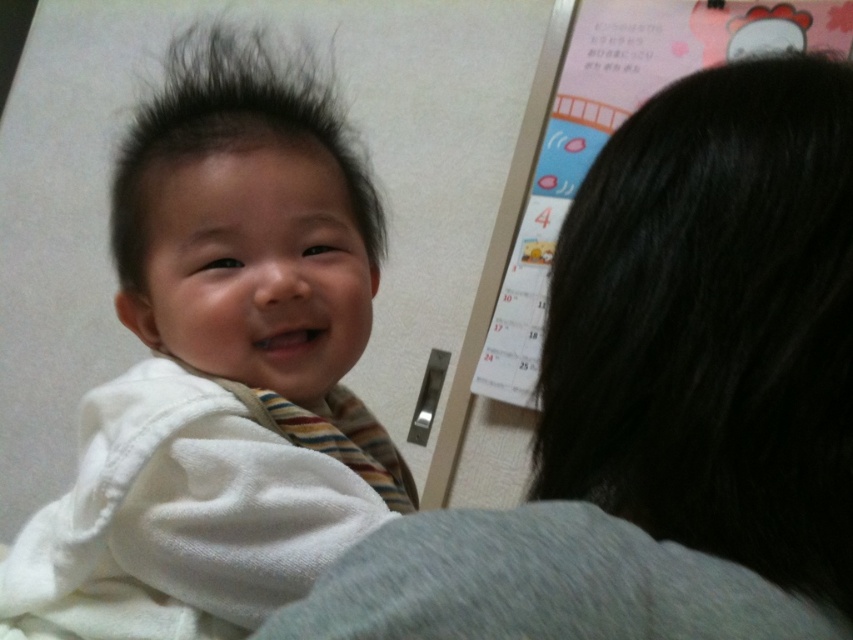
Between gray fabric at upper left and white soft fabric baby at center, which one appears on the left side from the viewer's perspective?

white soft fabric baby at center

Is point (370, 582) behind point (152, 384)?

That is False.

Measure the distance between gray fabric at upper left and camera.

gray fabric at upper left is 8.49 inches away from camera.

I want to click on gray fabric at upper left, so click(665, 397).

Which is below, white soft fabric baby at center or dark brown fuzzy hair at upper left?

Positioned lower is white soft fabric baby at center.

Can you confirm if white soft fabric baby at center is positioned to the right of dark brown fuzzy hair at upper left?

Indeed, white soft fabric baby at center is positioned on the right side of dark brown fuzzy hair at upper left.

Who is more forward, (252,362) or (142,276)?

Point (252,362)

Where is `white soft fabric baby at center`? white soft fabric baby at center is located at coordinates (221, 369).

Between gray fabric at upper left and dark brown fuzzy hair at upper left, which one has more height?

dark brown fuzzy hair at upper left is taller.

From the picture: Is gray fabric at upper left positioned at the back of dark brown fuzzy hair at upper left?

No.

Where is `gray fabric at upper left`? This screenshot has height=640, width=853. gray fabric at upper left is located at coordinates (665, 397).

The width and height of the screenshot is (853, 640). What are the coordinates of `gray fabric at upper left` in the screenshot? It's located at (665, 397).